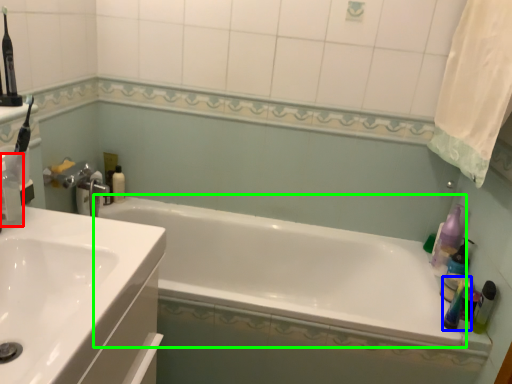
Question: Which is farther away from cleaning product (highlighted by a red box)? mouthwash (highlighted by a blue box) or bathtub (highlighted by a green box)?

Choices:
 (A) mouthwash
 (B) bathtub

Answer: (A)